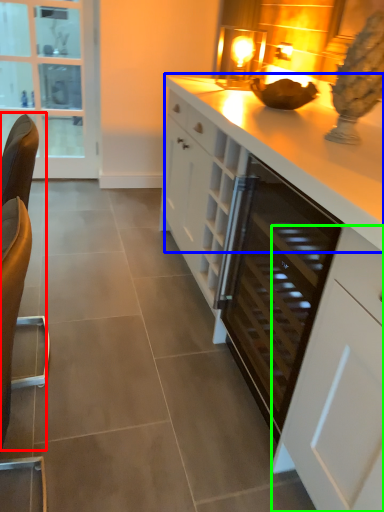
Question: Which object is positioned farthest from swivel chair (highlighted by a red box)? Select from countertop (highlighted by a blue box) and cabinetry (highlighted by a green box).

Choices:
 (A) countertop
 (B) cabinetry

Answer: (A)